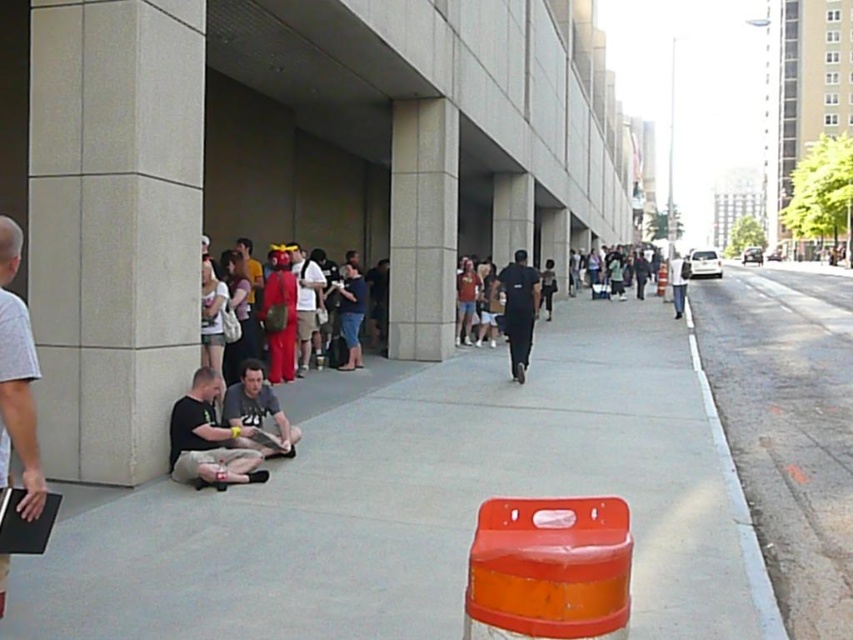
Can you confirm if beige stone pillar at center is positioned to the left of dark blue shirt at center?

Yes, beige stone pillar at center is to the left of dark blue shirt at center.

Can you confirm if beige stone pillar at center is taller than dark blue shirt at center?

Yes, beige stone pillar at center is taller than dark blue shirt at center.

Who is more forward, [438,122] or [521,342]?

Positioned in front is point [521,342].

At what (x,y) coordinates should I click in order to perform the action: click on beige stone pillar at center. Please return your answer as a coordinate pair (x, y). Image resolution: width=853 pixels, height=640 pixels. Looking at the image, I should click on (422, 228).

Which is above, dark blue shirt at center or matte red shirt at center?

dark blue shirt at center

What do you see at coordinates (518, 308) in the screenshot? I see `dark blue shirt at center` at bounding box center [518, 308].

Does point (532, 310) lie in front of point (311, 262)?

Yes.

Locate an element on the screen. The image size is (853, 640). dark blue shirt at center is located at coordinates (518, 308).

Who is shorter, beige stone pillar at center or black t-shirt at lower left?

black t-shirt at lower left

Between beige stone pillar at center and black t-shirt at lower left, which one has more height?

beige stone pillar at center is taller.

Measure the distance between point (x=428, y=333) and camera.

Point (x=428, y=333) and camera are 13.38 meters apart.

Find the location of `beige stone pillar at center`. beige stone pillar at center is located at coordinates (422, 228).